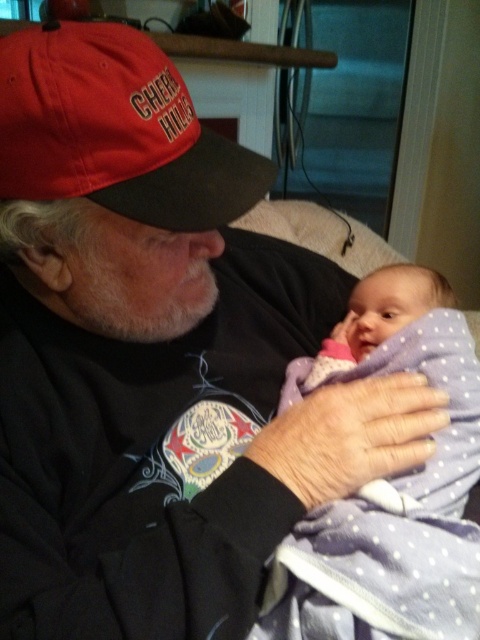
Question: Does purple polka dot blanket at center have a lesser width compared to red matte baseball cap at upper left?

Choices:
 (A) yes
 (B) no

Answer: (B)

Question: Is purple polka dot blanket at center bigger than red matte baseball cap at upper left?

Choices:
 (A) yes
 (B) no

Answer: (A)

Question: Does purple polka dot blanket at center have a smaller size compared to red matte baseball cap at upper left?

Choices:
 (A) no
 (B) yes

Answer: (A)

Question: Which point is farther to the camera?

Choices:
 (A) (140, 170)
 (B) (322, 600)

Answer: (A)

Question: Which point appears closest to the camera in this image?

Choices:
 (A) (417, 509)
 (B) (140, 54)

Answer: (A)

Question: Which object is closer to the camera taking this photo?

Choices:
 (A) red matte baseball cap at upper left
 (B) purple polka dot blanket at center

Answer: (B)